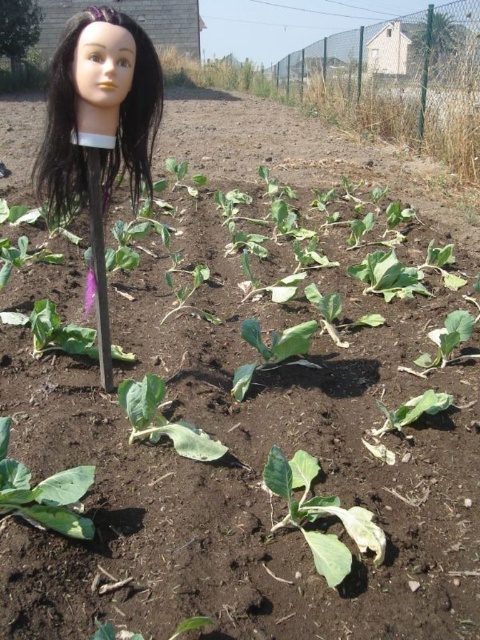
You are a gardener looking at the garden bed. You see the green matte leafy vegetable at center and the green leafy vegetable at center. Which one is closer to you?

The green matte leafy vegetable at center is closer because it is in front of the green leafy vegetable at center.

You are a gardener looking at the garden bed. Where exactly is the green matte leafy vegetable at center located in the garden bed?

The green matte leafy vegetable at center is located at point (321, 515) in the garden bed.